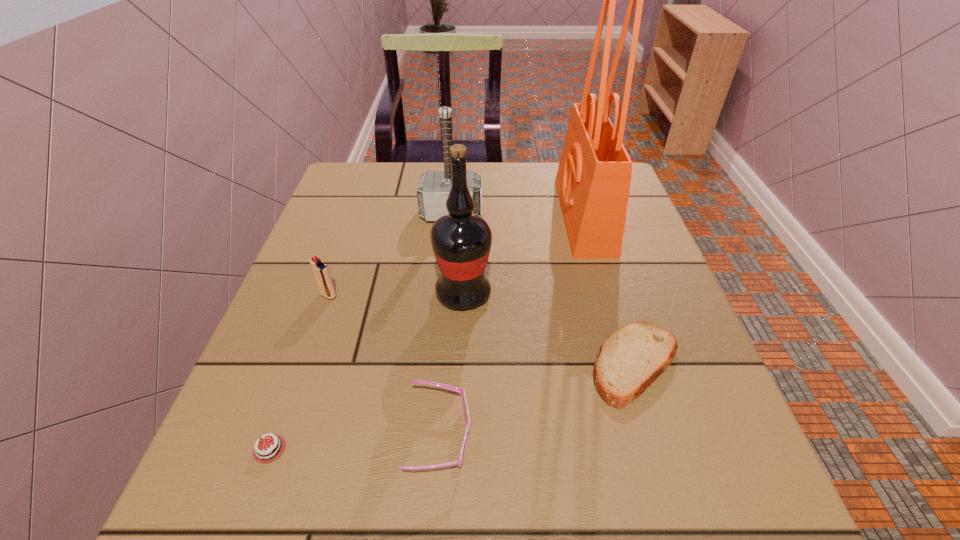
The width and height of the screenshot is (960, 540). I want to click on vacant point located between the tote bag and the second shortest object, so click(610, 290).

Locate an element on the screen. This screenshot has width=960, height=540. vacant point located between the tallest object and the fifth shortest object is located at coordinates (517, 215).

The width and height of the screenshot is (960, 540). Identify the location of object that is the fourth nearest to the chocolate cake. (631, 358).

Locate an element on the screen. The image size is (960, 540). object that stands as the fifth closest to the pita bread is located at coordinates (269, 450).

The height and width of the screenshot is (540, 960). Identify the location of free point that satisfies the following two spatial constraints: 1. on the front side of the second tallest object; 2. on the front-facing side of the sunglasses. (458, 436).

You are a GUI agent. You are given a task and a screenshot of the screen. Output one action in this format:
    pyautogui.click(x=<x>, y=<y>)
    Task: Click on the vacant space that satisfies the following two spatial constraints: 1. on the logo side of the tallest object; 2. on the left side of the pita bread
    The image size is (960, 540).
    Given the screenshot: What is the action you would take?
    pyautogui.click(x=628, y=364)

I want to click on vacant space that satisfies the following two spatial constraints: 1. on the back side of the sixth tallest object; 2. on the logo side of the tallest object, so click(x=589, y=216).